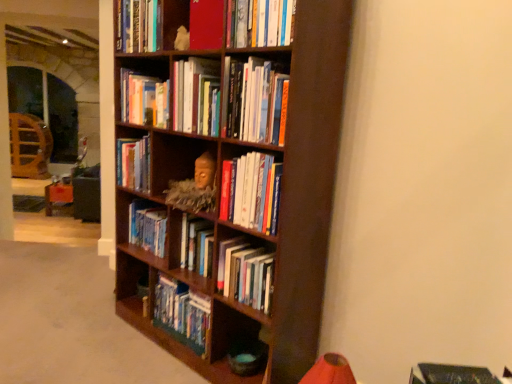
Question: Is dark wood bookcase at center closer to camera compared to matte red book at upper center, the second book positioned from the top?

Choices:
 (A) yes
 (B) no

Answer: (A)

Question: Can you confirm if dark wood bookcase at center is positioned to the left of matte red book at upper center, the second book positioned from the top?

Choices:
 (A) no
 (B) yes

Answer: (B)

Question: Can you confirm if dark wood bookcase at center is positioned to the right of matte red book at upper center, the second book positioned from the top?

Choices:
 (A) no
 (B) yes

Answer: (A)

Question: Is dark wood bookcase at center wider than matte red book at upper center, the second book positioned from the top?

Choices:
 (A) yes
 (B) no

Answer: (A)

Question: Is dark wood bookcase at center positioned far away from matte red book at upper center, which is counted as the 9th book, starting from the bottom?

Choices:
 (A) yes
 (B) no

Answer: (B)

Question: In the image, is matte red book at upper center, which is counted as the 9th book, starting from the bottom, on the left side or the right side of hardcover book at center, the 2th book positioned from the bottom?

Choices:
 (A) left
 (B) right

Answer: (A)

Question: Considering the positions of matte red book at upper center, the second book positioned from the top, and hardcover book at center, the 9th book in the top-to-bottom sequence, in the image, is matte red book at upper center, the second book positioned from the top, wider or thinner than hardcover book at center, the 9th book in the top-to-bottom sequence,?

Choices:
 (A) wide
 (B) thin

Answer: (A)

Question: Is point (222, 1) closer or farther from the camera than point (497, 377)?

Choices:
 (A) farther
 (B) closer

Answer: (A)

Question: From the image's perspective, is matte red book at upper center, the second book positioned from the top, above or below hardcover book at center, the 9th book in the top-to-bottom sequence?

Choices:
 (A) below
 (B) above

Answer: (B)

Question: Is hardcover books at center, the 7th book ordered from the bottom, inside the boundaries of dark wood bookcase at center, or outside?

Choices:
 (A) outside
 (B) inside

Answer: (B)

Question: Would you say hardcover books at center, the fourth book viewed from the top, is to the left or to the right of dark wood bookcase at center in the picture?

Choices:
 (A) left
 (B) right

Answer: (A)

Question: Considering the positions of hardcover books at center, the fourth book viewed from the top, and dark wood bookcase at center in the image, is hardcover books at center, the fourth book viewed from the top, wider or thinner than dark wood bookcase at center?

Choices:
 (A) wide
 (B) thin

Answer: (B)

Question: From the image's perspective, relative to dark wood bookcase at center, is hardcover books at center, the 7th book ordered from the bottom, above or below?

Choices:
 (A) above
 (B) below

Answer: (A)

Question: Considering their positions, is hardcover books at center, the 3th book positioned from the bottom, located in front of or behind hardcover books at center, arranged as the 6th book when ordered from the bottom?

Choices:
 (A) behind
 (B) front

Answer: (B)

Question: Is point (228, 243) positioned closer to the camera than point (186, 102)?

Choices:
 (A) farther
 (B) closer

Answer: (B)